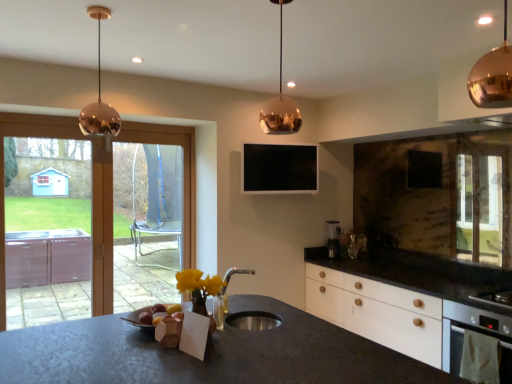
The width and height of the screenshot is (512, 384). Find the location of `blank space above black glossy tv at upper center (from a real-world perspective)`. blank space above black glossy tv at upper center (from a real-world perspective) is located at coordinates (286, 139).